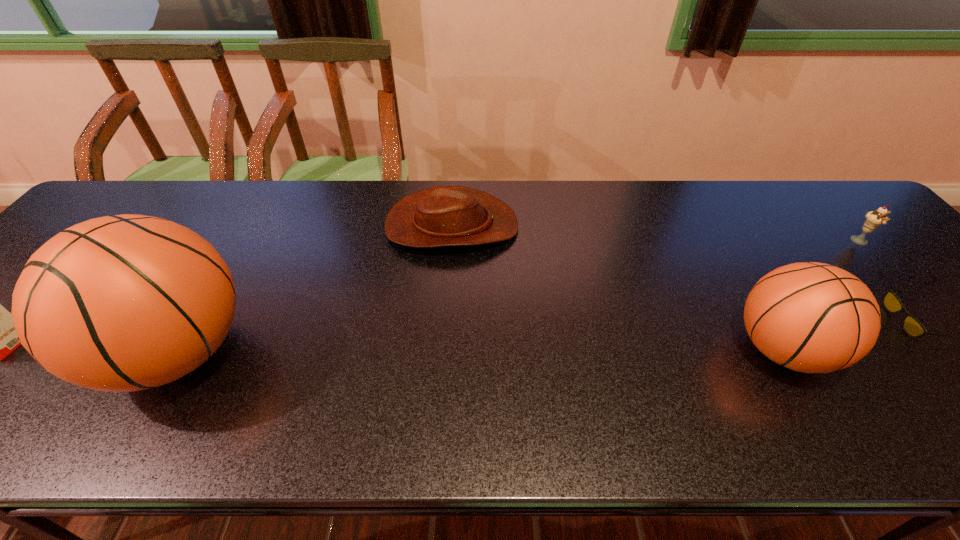
The width and height of the screenshot is (960, 540). Identify the location of vacant space situated 0.210m on the front-facing side of the second shortest object. (592, 226).

Where is `vacant area situated on the back of the icecream`? The height and width of the screenshot is (540, 960). vacant area situated on the back of the icecream is located at coordinates (826, 204).

Identify the location of free space located on the front-facing side of the shortest object. (742, 321).

The height and width of the screenshot is (540, 960). Identify the location of vacant area situated 0.260m on the front-facing side of the shortest object. (781, 321).

Identify the location of free spot located 0.280m on the front-facing side of the shortest object. click(772, 321).

Locate an element on the screen. This screenshot has width=960, height=540. object that is at the far edge is located at coordinates (440, 216).

Where is `icecream that is at the right edge`? The height and width of the screenshot is (540, 960). icecream that is at the right edge is located at coordinates (873, 220).

You are a GUI agent. You are given a task and a screenshot of the screen. Output one action in this format:
    pyautogui.click(x=<x>, y=<y>)
    Task: Click on the sunglasses located at the right edge
    
    Given the screenshot: What is the action you would take?
    pyautogui.click(x=912, y=326)

In the image, there is a desktop. Identify the location of blank space at the far edge. This screenshot has height=540, width=960. (712, 210).

Locate an element on the screen. The height and width of the screenshot is (540, 960). free space at the near edge of the desktop is located at coordinates (540, 379).